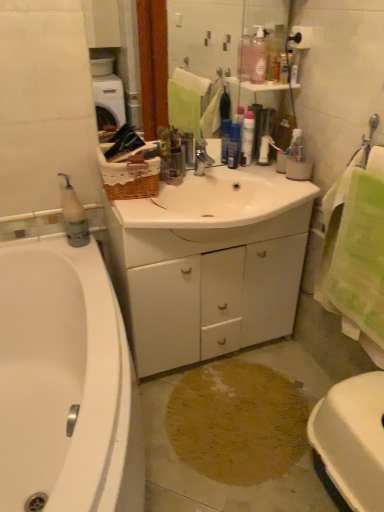
Question: From the image's perspective, would you say white plastic bottle at left, marked as the 2th cleaning product in a top-to-bottom arrangement, is shown under white glossy bathtub at left?

Choices:
 (A) yes
 (B) no

Answer: (B)

Question: Can you confirm if white plastic bottle at left, marked as the 2th cleaning product in a top-to-bottom arrangement, is taller than white glossy bathtub at left?

Choices:
 (A) yes
 (B) no

Answer: (B)

Question: Is white plastic bottle at left, which ranks as the first cleaning product in bottom-to-top order, next to white glossy bathtub at left and touching it?

Choices:
 (A) yes
 (B) no

Answer: (B)

Question: Is white plastic bottle at left, which ranks as the first cleaning product in bottom-to-top order, thinner than white glossy bathtub at left?

Choices:
 (A) no
 (B) yes

Answer: (B)

Question: From a real-world perspective, is white plastic bottle at left, arranged as the first cleaning product when viewed from the left, positioned under white glossy bathtub at left based on gravity?

Choices:
 (A) no
 (B) yes

Answer: (A)

Question: Can you confirm if white plastic bottle at left, marked as the 2th cleaning product in a top-to-bottom arrangement, is positioned to the right of white glossy bathtub at left?

Choices:
 (A) yes
 (B) no

Answer: (B)

Question: Is white glossy bathtub at left at the back of white matte cabinet at center?

Choices:
 (A) yes
 (B) no

Answer: (B)

Question: Is white matte cabinet at center thinner than white glossy bathtub at left?

Choices:
 (A) yes
 (B) no

Answer: (A)

Question: Does white matte cabinet at center have a greater height compared to white glossy bathtub at left?

Choices:
 (A) yes
 (B) no

Answer: (A)

Question: Is white matte cabinet at center placed right next to white glossy bathtub at left?

Choices:
 (A) no
 (B) yes

Answer: (A)

Question: Can you confirm if white matte cabinet at center is positioned to the left of white glossy bathtub at left?

Choices:
 (A) yes
 (B) no

Answer: (B)

Question: From the image's perspective, is white matte cabinet at center above white glossy bathtub at left?

Choices:
 (A) no
 (B) yes

Answer: (B)

Question: Is white glossy bathtub at left directly adjacent to pink translucent bottle at upper center, which ranks as the first cleaning product in top-to-bottom order?

Choices:
 (A) yes
 (B) no

Answer: (B)